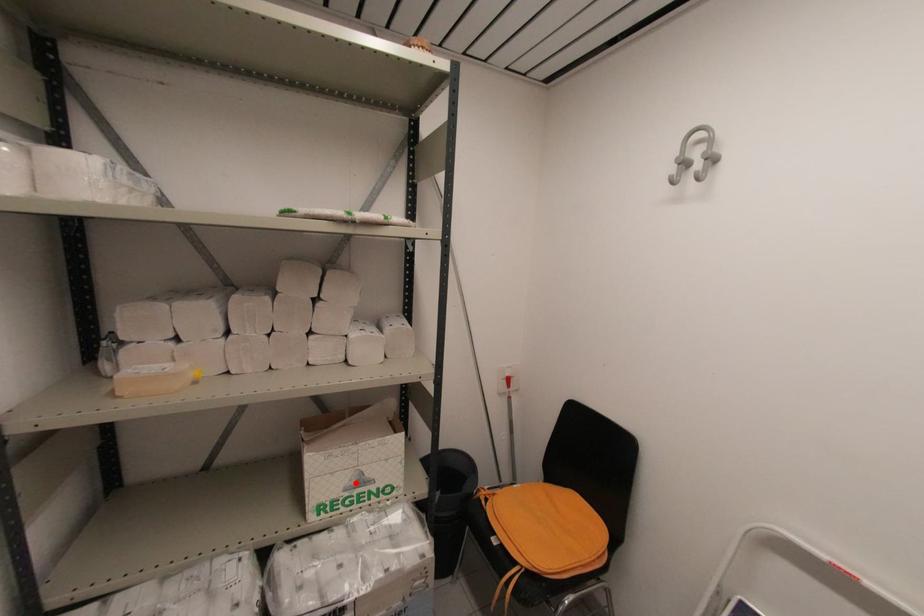
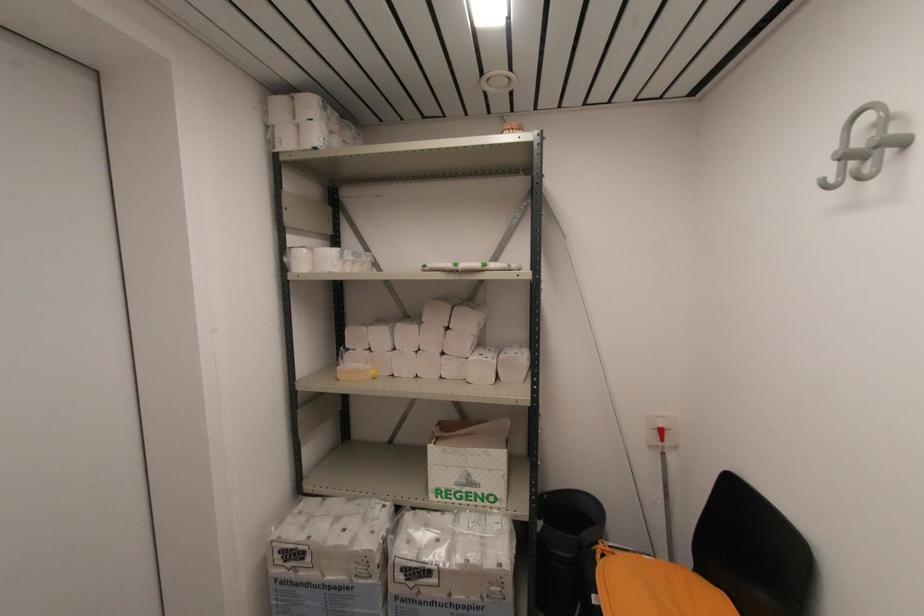
In the second image, find the point that corresponds to the highlighted location in the first image.

(465, 480)